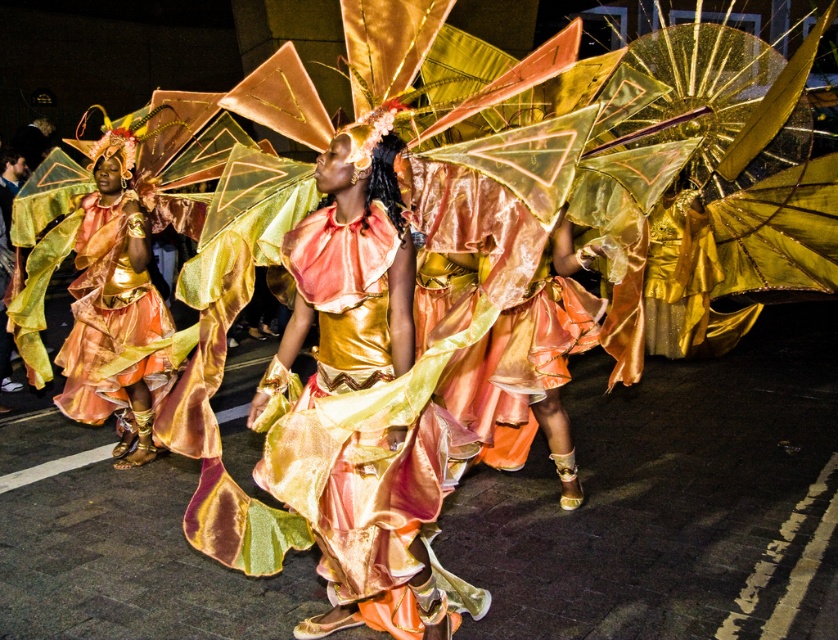
Which of these two, shiny satin dress at center or metallic gold dress at left, stands taller?

metallic gold dress at left is taller.

Can you confirm if shiny satin dress at center is taller than metallic gold dress at left?

No.

Image resolution: width=838 pixels, height=640 pixels. I want to click on shiny satin dress at center, so click(x=357, y=432).